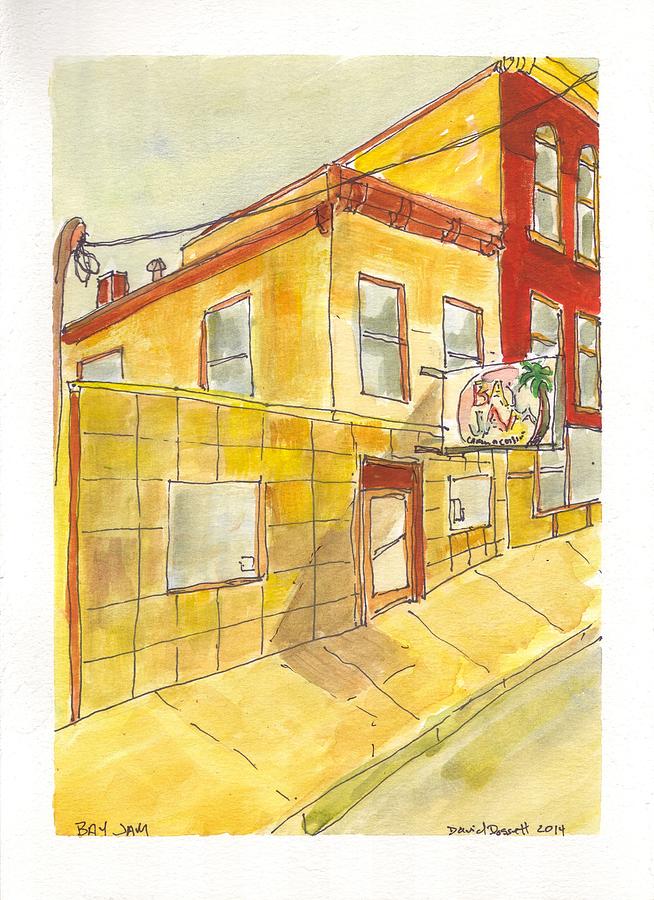
Find the location of a particular element. This screenshot has width=654, height=900. door is located at coordinates (385, 533).